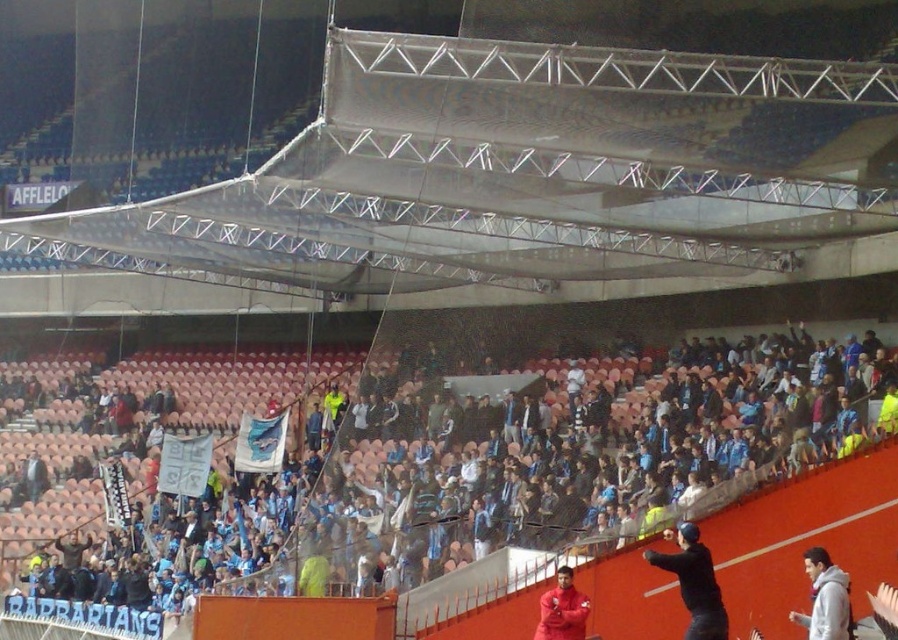
From the picture: Is gray fleece jacket at lower right to the left of matte red jacket at lower center from the viewer's perspective?

Incorrect, gray fleece jacket at lower right is not on the left side of matte red jacket at lower center.

Describe the element at coordinates (825, 598) in the screenshot. I see `gray fleece jacket at lower right` at that location.

Image resolution: width=898 pixels, height=640 pixels. What do you see at coordinates (825, 598) in the screenshot?
I see `gray fleece jacket at lower right` at bounding box center [825, 598].

Where is `gray fleece jacket at lower right`? gray fleece jacket at lower right is located at coordinates (825, 598).

Who is positioned more to the left, blue fabric crowd at center or gray fleece jacket at lower right?

blue fabric crowd at center

Identify the location of blue fabric crowd at center. The width and height of the screenshot is (898, 640). (487, 483).

Find the location of a particular element. The width and height of the screenshot is (898, 640). blue fabric crowd at center is located at coordinates (487, 483).

Which is in front, point (136, 548) or point (703, 561)?

Point (703, 561) is in front.

This screenshot has width=898, height=640. I want to click on blue fabric crowd at center, so click(487, 483).

Find the location of a particular element. The width and height of the screenshot is (898, 640). blue fabric crowd at center is located at coordinates (487, 483).